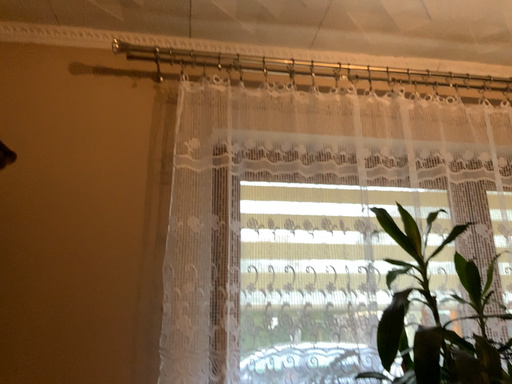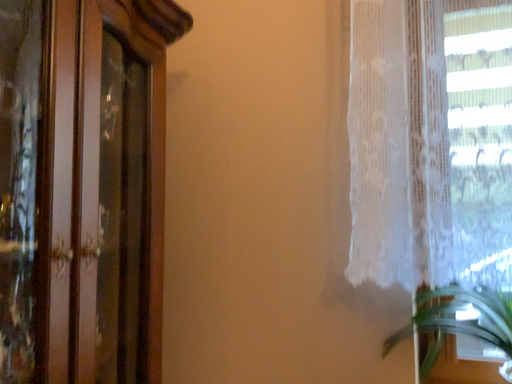
Question: How did the camera likely rotate when shooting the video?

Choices:
 (A) rotated downward
 (B) rotated upward

Answer: (A)